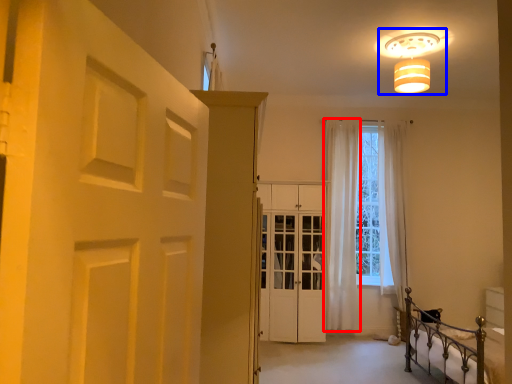
Question: Which of the following is the farthest to the observer, curtain (highlighted by a red box) or lamp (highlighted by a blue box)?

Choices:
 (A) curtain
 (B) lamp

Answer: (A)